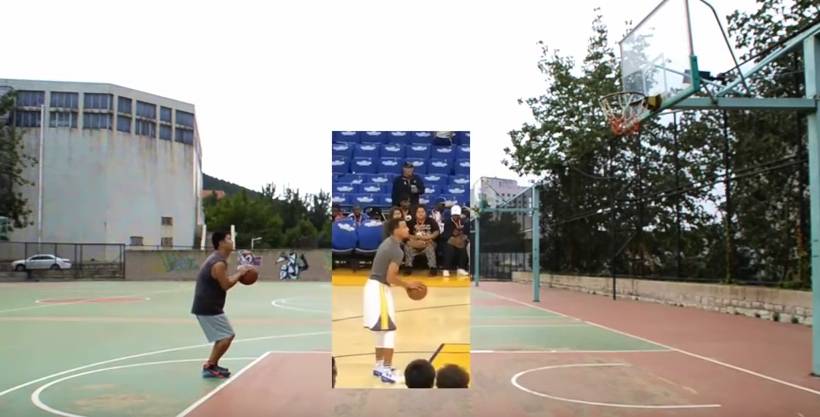
Where is `glass`? glass is located at coordinates (653, 69).